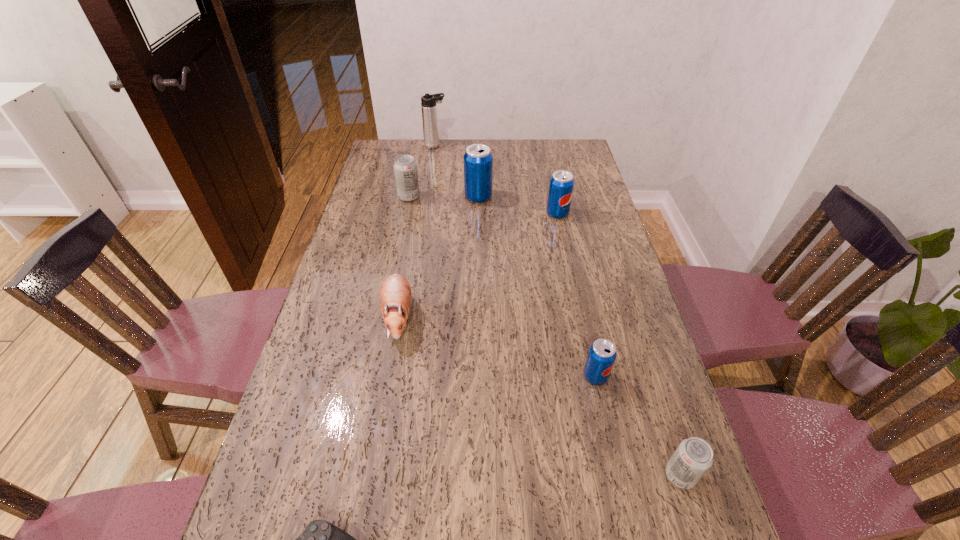
The height and width of the screenshot is (540, 960). Find the location of `the sixth farthest object`. the sixth farthest object is located at coordinates coord(602,353).

Locate an element on the screen. This screenshot has width=960, height=540. the rightmost object is located at coordinates (691, 460).

You are a GUI agent. You are given a task and a screenshot of the screen. Output one action in this format:
    pyautogui.click(x=<x>, y=<y>)
    Task: Click on the nearer gray soda can
    This screenshot has height=540, width=960.
    Given the screenshot: What is the action you would take?
    pyautogui.click(x=691, y=460)

This screenshot has width=960, height=540. Identify the location of free space located on the handle side of the farthest object. (536, 146).

Where is `vacant space located on the right of the second tallest object`? This screenshot has height=540, width=960. vacant space located on the right of the second tallest object is located at coordinates (572, 197).

Where is `free space located on the right of the left gray soda can`? The image size is (960, 540). free space located on the right of the left gray soda can is located at coordinates (452, 197).

The image size is (960, 540). Identify the location of vacant space located on the left of the fifth nearest object. (484, 213).

Identify the location of free space located at the face of the fifth farthest object. This screenshot has height=540, width=960. (385, 394).

At what (x,y) coordinates should I click in order to perform the action: click on blank space located on the front of the second nearest soda can. Please return your answer as a coordinate pair (x, y). The width and height of the screenshot is (960, 540). Looking at the image, I should click on (613, 457).

At what (x,y) coordinates should I click in order to perform the action: click on vacant space located 0.240m on the back of the smaller gray soda can. Please return your answer as a coordinate pair (x, y). Looking at the image, I should click on (645, 366).